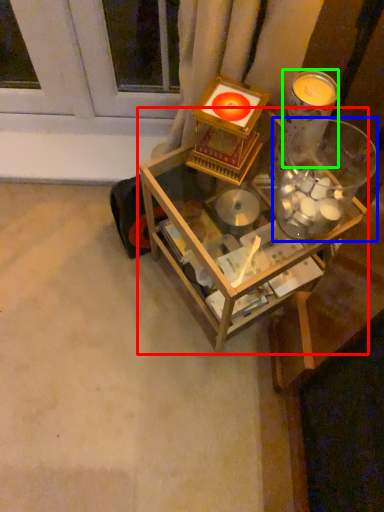
Question: Which is nearer to the table (highlighted by a red box)? glass jar (highlighted by a blue box) or candle holder (highlighted by a green box).

Choices:
 (A) glass jar
 (B) candle holder

Answer: (A)